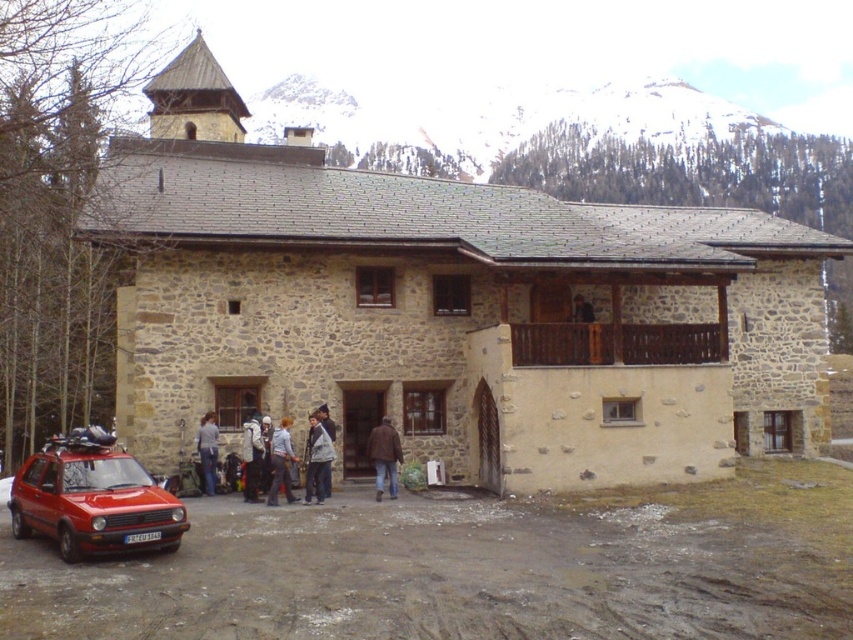
You are standing at the coordinates 0.5, 0.5 in the image. Can you see the stone church at center from your current position?

Yes, since the stone church at center is located at point [450,308], which is very close to your position at [426,320], you can see it clearly.

You are a delivery person needing to reach the white snowboard at center from the shiny red car at lower left. Can you walk directly to it without moving any objects?

The distance between the shiny red car at lower left and the white snowboard at center is 17.63 feet, so yes, you can walk directly to the white snowboard at center without moving any objects since there is enough space between them.

You are standing in front of the stone church at center and the brown leather jacket at center. Which object is taller?

The stone church at center is much taller than the brown leather jacket at center.